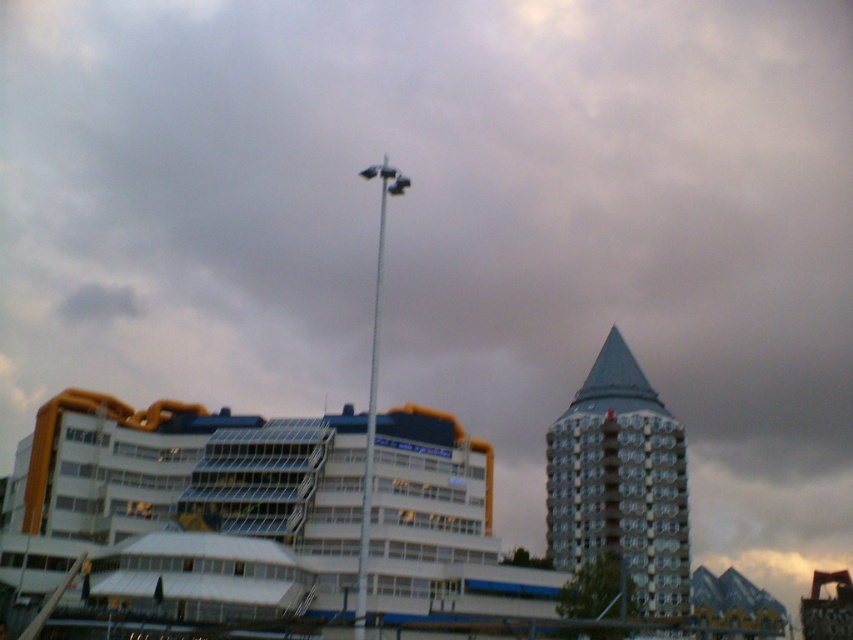
You are standing at the origin point in the image. Which direction should you move to reach the white glossy building at center?

The white glossy building at center is located at coordinates point (189, 506), so you should move towards the right and slightly upwards from the origin point to reach it.

Consider the image. You are an architect planning to install a large sculpture between the white glossy building at center and the blue glass tower at upper center. The sculpture requires a minimum of 100 feet of space between the two buildings to be safely installed. Based on the scene description, will the available space between them allow for the sculpture to be placed?

The white glossy building at center and blue glass tower at upper center are 101.36 feet apart, which exceeds the required 100 feet minimum space. Therefore, the sculpture can be safely installed between them.

You are a drone operator trying to capture aerial footage of the blue glass tower at upper center. You notice a white metallic pole at center in your camera view. Based on the scene, will the pole block your view of the tower?

The white metallic pole at center is behind the blue glass tower at upper center, so it will not block your view of the tower.